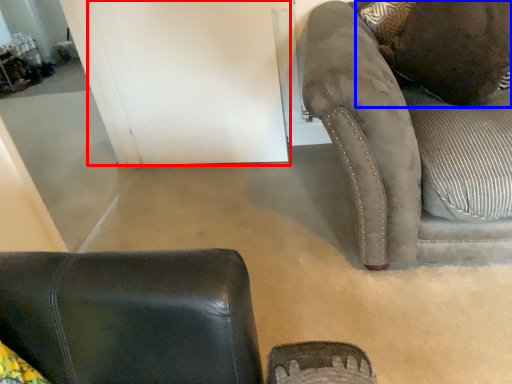
Question: Among these objects, which one is farthest to the camera, door (highlighted by a red box) or pillow (highlighted by a blue box)?

Choices:
 (A) door
 (B) pillow

Answer: (A)